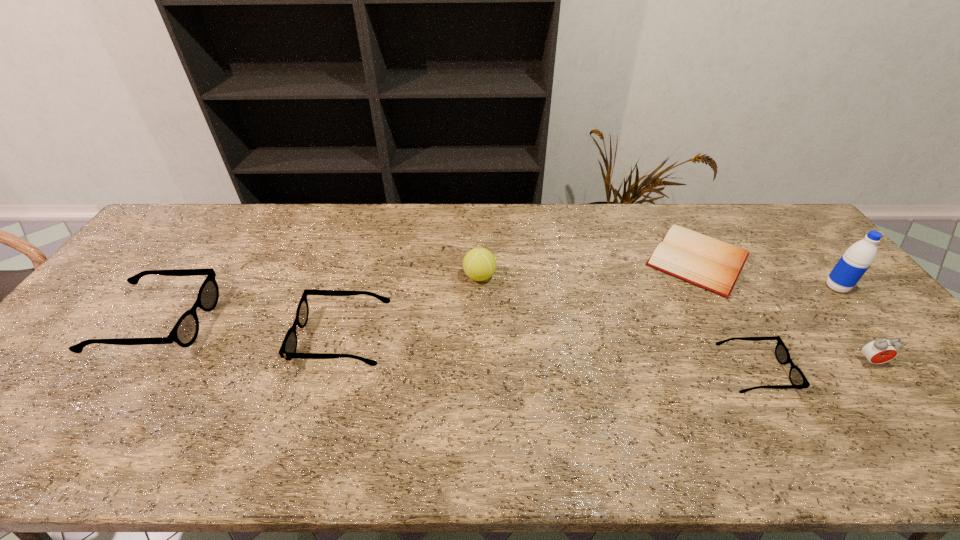
Where is `unoccupied position between the tennis ball and the shortest spectacles`? The width and height of the screenshot is (960, 540). unoccupied position between the tennis ball and the shortest spectacles is located at coordinates (617, 324).

I want to click on unoccupied position between the rightmost spectacles and the leftmost spectacles, so click(456, 347).

Image resolution: width=960 pixels, height=540 pixels. I want to click on free spot between the fifth tallest object and the sixth object from left to right, so click(607, 350).

At what (x,y) coordinates should I click in order to perform the action: click on free space between the third shortest object and the shortest spectacles. Please return your answer as a coordinate pair (x, y). The width and height of the screenshot is (960, 540). Looking at the image, I should click on (549, 355).

Identify the location of vacant space that's between the water bottle and the tennis ball. (658, 282).

Locate an element on the screen. The image size is (960, 540). free area in between the shortest object and the second shortest object is located at coordinates (726, 316).

Find the location of a particular element. This screenshot has width=960, height=540. vacant region between the shortest spectacles and the Bible is located at coordinates (726, 316).

Locate an element on the screen. The width and height of the screenshot is (960, 540). empty space that is in between the rightmost object and the second shortest object is located at coordinates click(x=795, y=329).

Locate an element on the screen. Image resolution: width=960 pixels, height=540 pixels. free space between the shortest spectacles and the leftmost spectacles is located at coordinates (456, 347).

Locate which object is the fourth closest to the water bottle. Please provide its 2D coordinates. Your answer should be formatted as a tuple, i.e. [(x, y)], where the tuple contains the x and y coordinates of a point satisfying the conditions above.

[(479, 264)]